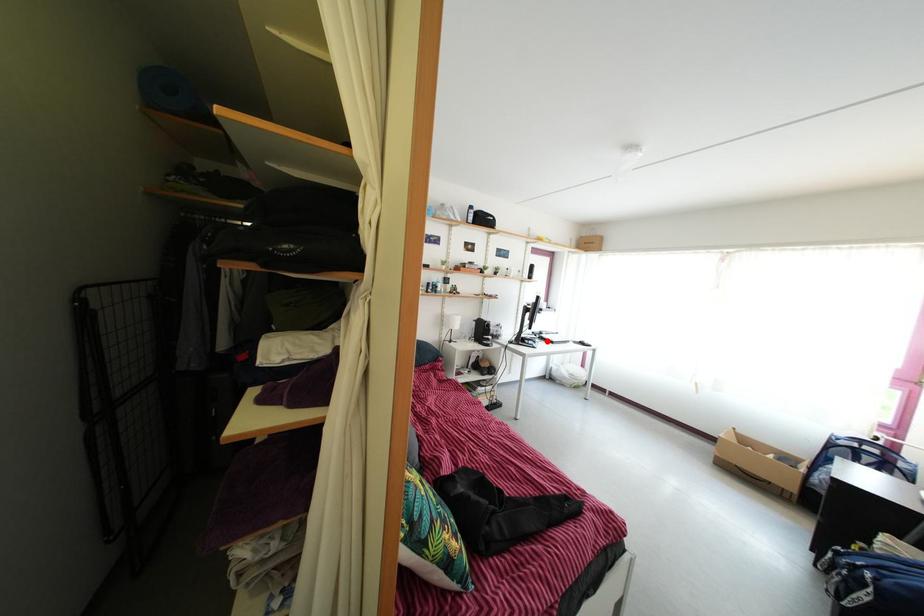
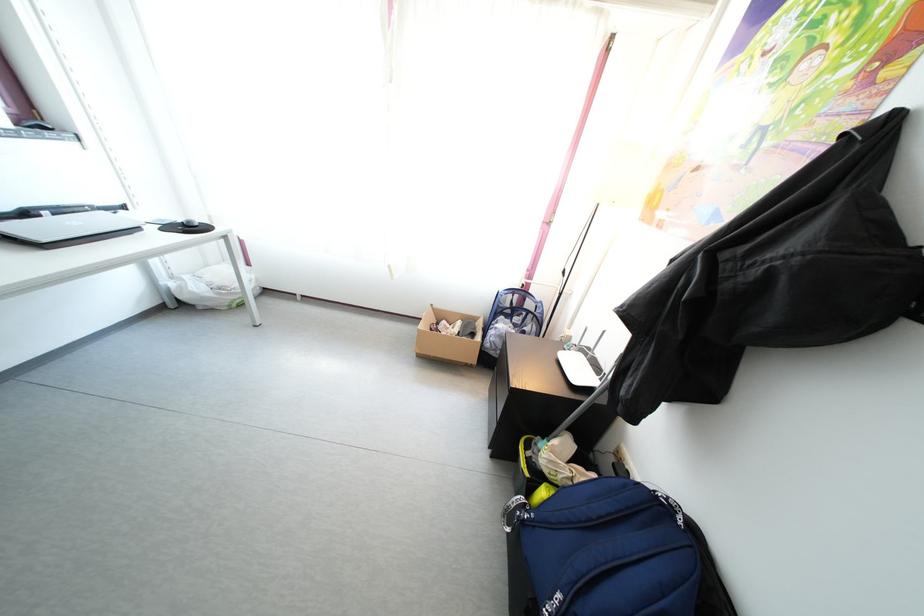
Locate, in the second image, the point that corresponds to the highlighted location in the first image.

(31, 222)